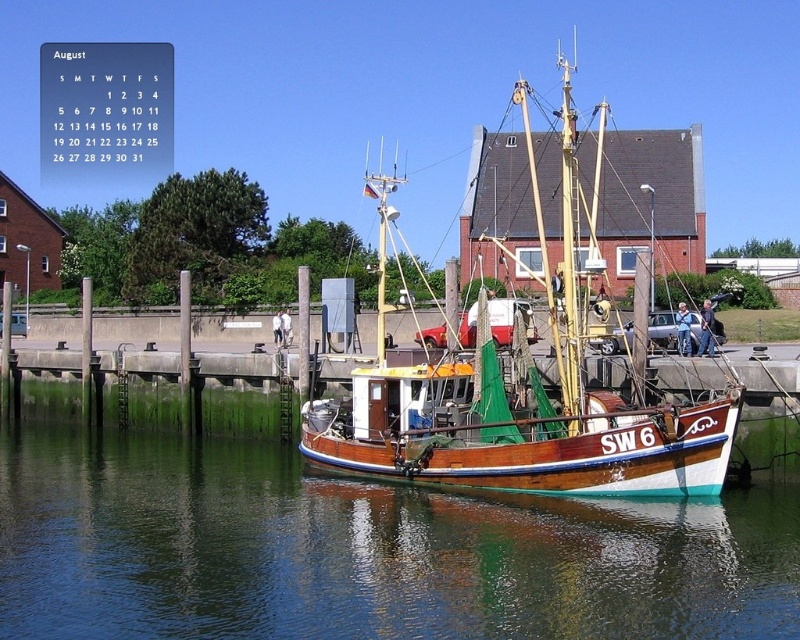
Question: Observing the image, what is the correct spatial positioning of glossy water at boat right in reference to wooden boat at center?

Choices:
 (A) right
 (B) left

Answer: (B)

Question: Does glossy water at boat right appear on the left side of wooden boat at center?

Choices:
 (A) yes
 (B) no

Answer: (A)

Question: Which of the following is the closest to the observer?

Choices:
 (A) (720, 566)
 (B) (732, 392)

Answer: (A)

Question: Which point is farther from the camera taking this photo?

Choices:
 (A) (705, 464)
 (B) (668, 582)

Answer: (A)

Question: Can you confirm if glossy water at boat right is thinner than wooden boat at center?

Choices:
 (A) yes
 (B) no

Answer: (A)

Question: Among these objects, which one is nearest to the camera?

Choices:
 (A) wooden boat at center
 (B) glossy water at boat right

Answer: (B)